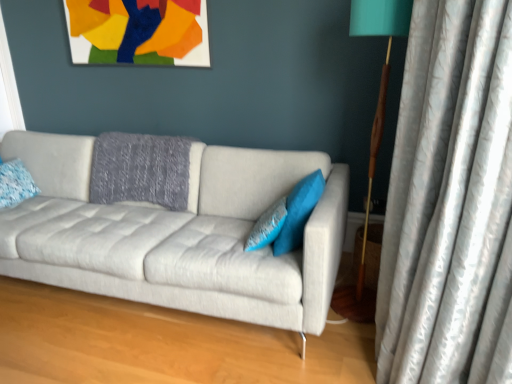
Locate an element on the screen. Image resolution: width=512 pixels, height=384 pixels. matte paper picture frame at upper center is located at coordinates [138, 32].

What is the approximate height of blue textured pillow at center, the 2th pillow from the left?

blue textured pillow at center, the 2th pillow from the left, is 8.65 inches tall.

This screenshot has width=512, height=384. I want to click on blue textured pillow at center, the 2th pillow from the left, so click(x=267, y=226).

What do you see at coordinates (450, 202) in the screenshot?
I see `silvery textured curtain at right` at bounding box center [450, 202].

Identify the location of matte paper picture frame at upper center. The image size is (512, 384). (138, 32).

Is silvery textured curtain at right inside light gray fabric couch at center?

That's incorrect, silvery textured curtain at right is not inside light gray fabric couch at center.

From the image's perspective, which is above, light gray fabric couch at center or silvery textured curtain at right?

light gray fabric couch at center.

Does light gray fabric couch at center have a lesser width compared to silvery textured curtain at right?

No.

Between light gray fabric couch at center and silvery textured curtain at right, which one appears on the left side from the viewer's perspective?

Positioned to the left is light gray fabric couch at center.

From a real-world perspective, is teal fabric lampshade at right over blue textured pillow at center, the 2th pillow from the left?

Yes, from a real-world perspective, teal fabric lampshade at right is on top of blue textured pillow at center, the 2th pillow from the left.

Based on the photo, can you tell me how much teal fabric lampshade at right and blue textured pillow at center, the second pillow positioned from the right, differ in facing direction?

The angular difference between teal fabric lampshade at right and blue textured pillow at center, the second pillow positioned from the right, is 73.3 degrees.

Which of these two, teal fabric lampshade at right or blue textured pillow at center, the 2th pillow from the left, is bigger?

teal fabric lampshade at right is bigger.

Consider the image. From the image's perspective, between teal fabric lampshade at right and blue textured pillow at center, the 2th pillow from the left, who is located below?

blue textured pillow at center, the 2th pillow from the left.

Would you say teal fabric pillow at center, the third pillow from the left, is inside or outside matte paper picture frame at upper center?

teal fabric pillow at center, the third pillow from the left, is not inside matte paper picture frame at upper center, it's outside.

Which object is more forward, teal fabric pillow at center, the third pillow from the left, or matte paper picture frame at upper center?

teal fabric pillow at center, the third pillow from the left, is in front.

Could you tell me if teal fabric pillow at center, which is the 1th pillow from right to left, is facing matte paper picture frame at upper center?

No, teal fabric pillow at center, which is the 1th pillow from right to left, is not turned towards matte paper picture frame at upper center.

Which of these two, teal fabric pillow at center, the third pillow from the left, or matte paper picture frame at upper center, stands shorter?

teal fabric pillow at center, the third pillow from the left.

Considering the positions of objects matte paper picture frame at upper center and silvery textured curtain at right in the image provided, who is in front, matte paper picture frame at upper center or silvery textured curtain at right?

silvery textured curtain at right is in front.

Is matte paper picture frame at upper center inside or outside of silvery textured curtain at right?

The correct answer is: outside.

I want to click on picture frame on the left of the silvery textured curtain at right, so click(138, 32).

Is point (119, 29) closer or farther from the camera than point (463, 238)?

Point (119, 29) is positioned farther from the camera compared to point (463, 238).

Based on the photo, is blue textured pillow at left, the first pillow in the left-to-right sequence, looking in the opposite direction of matte paper picture frame at upper center?

blue textured pillow at left, the first pillow in the left-to-right sequence, does not have its back to matte paper picture frame at upper center.

Which object is more forward, blue textured pillow at left, the first pillow in the left-to-right sequence, or matte paper picture frame at upper center?

blue textured pillow at left, the first pillow in the left-to-right sequence, is in front.

In the scene shown: Measure the distance between blue textured pillow at left, the first pillow in the left-to-right sequence, and matte paper picture frame at upper center.

They are 1.08 meters apart.

Where is `picture frame that is above the blue textured pillow at left, the first pillow in the left-to-right sequence (from the image's perspective)`? picture frame that is above the blue textured pillow at left, the first pillow in the left-to-right sequence (from the image's perspective) is located at coordinates (138, 32).

Which is correct: silvery textured curtain at right is inside teal fabric lampshade at right, or outside of it?

silvery textured curtain at right exists outside the volume of teal fabric lampshade at right.

Is silvery textured curtain at right in contact with teal fabric lampshade at right?

No, silvery textured curtain at right is not touching teal fabric lampshade at right.

From a real-world perspective, does silvery textured curtain at right sit lower than teal fabric lampshade at right?

Yes, from a real-world perspective, silvery textured curtain at right is beneath teal fabric lampshade at right.

Image resolution: width=512 pixels, height=384 pixels. Find the location of `table lamp on the left side of silvery textured curtain at right`. table lamp on the left side of silvery textured curtain at right is located at coordinates tap(381, 78).

From the image's perspective, count 2nd pillows upward from the silvery textured curtain at right and point to it. Please provide its 2D coordinates.

[(298, 212)]

Does silvery textured curtain at right touch teal fabric pillow at center, which is the 1th pillow from right to left?

No, silvery textured curtain at right is not touching teal fabric pillow at center, which is the 1th pillow from right to left.

Is silvery textured curtain at right at the left side of teal fabric pillow at center, the third pillow from the left?

In fact, silvery textured curtain at right is to the right of teal fabric pillow at center, the third pillow from the left.

Is silvery textured curtain at right bigger or smaller than teal fabric pillow at center, which is the 1th pillow from right to left?

silvery textured curtain at right is bigger than teal fabric pillow at center, which is the 1th pillow from right to left.

Where is `curtain that is below the light gray fabric couch at center (from the image's perspective)`? This screenshot has height=384, width=512. curtain that is below the light gray fabric couch at center (from the image's perspective) is located at coordinates (450, 202).

The height and width of the screenshot is (384, 512). Find the location of `table lamp above the blue textured pillow at center, the second pillow positioned from the right (from the image's perspective)`. table lamp above the blue textured pillow at center, the second pillow positioned from the right (from the image's perspective) is located at coordinates (381, 78).

When comparing their distances from teal fabric pillow at center, the third pillow from the left, does blue textured pillow at left, which is the 3th pillow from right to left, or blue textured pillow at center, the second pillow positioned from the right, seem further?

The object further to teal fabric pillow at center, the third pillow from the left, is blue textured pillow at left, which is the 3th pillow from right to left.

Based on their spatial positions, is silvery textured curtain at right or light gray fabric couch at center further from teal fabric pillow at center, the third pillow from the left?

silvery textured curtain at right lies further to teal fabric pillow at center, the third pillow from the left, than the other object.

Based on their spatial positions, is blue textured pillow at center, the 2th pillow from the left, or teal fabric pillow at center, the third pillow from the left, further from blue textured pillow at left, which is the 3th pillow from right to left?

teal fabric pillow at center, the third pillow from the left.

When comparing their distances from matte paper picture frame at upper center, does blue textured pillow at left, the first pillow in the left-to-right sequence, or light gray fabric couch at center seem closer?

light gray fabric couch at center lies closer to matte paper picture frame at upper center than the other object.

Which object lies nearer to the anchor point teal fabric lampshade at right, teal fabric pillow at center, which is the 1th pillow from right to left, or silvery textured curtain at right?

The object closer to teal fabric lampshade at right is teal fabric pillow at center, which is the 1th pillow from right to left.

From the picture: When comparing their distances from silvery textured curtain at right, does blue textured pillow at left, the first pillow in the left-to-right sequence, or teal fabric lampshade at right seem closer?

teal fabric lampshade at right is closer to silvery textured curtain at right.

Looking at the image, which one is located further to teal fabric lampshade at right, matte paper picture frame at upper center or blue textured pillow at center, the 2th pillow from the left?

The object further to teal fabric lampshade at right is matte paper picture frame at upper center.

Considering their positions, is blue textured pillow at center, the second pillow positioned from the right, positioned closer to teal fabric lampshade at right than light gray fabric couch at center?

Based on the image, blue textured pillow at center, the second pillow positioned from the right, appears to be nearer to teal fabric lampshade at right.

Find the location of a particular element. The image size is (512, 384). picture frame between blue textured pillow at left, which is the 3th pillow from right to left, and silvery textured curtain at right, in the horizontal direction is located at coordinates (138, 32).

What are the coordinates of `picture frame located between blue textured pillow at left, the first pillow in the left-to-right sequence, and teal fabric pillow at center, the third pillow from the left, in the left-right direction` in the screenshot? It's located at (138, 32).

Where is `studio couch between silvery textured curtain at right and matte paper picture frame at upper center from front to back`? studio couch between silvery textured curtain at right and matte paper picture frame at upper center from front to back is located at coordinates (177, 235).

The width and height of the screenshot is (512, 384). Identify the location of table lamp located between silvery textured curtain at right and blue textured pillow at center, the 2th pillow from the left, in the depth direction. point(381,78).